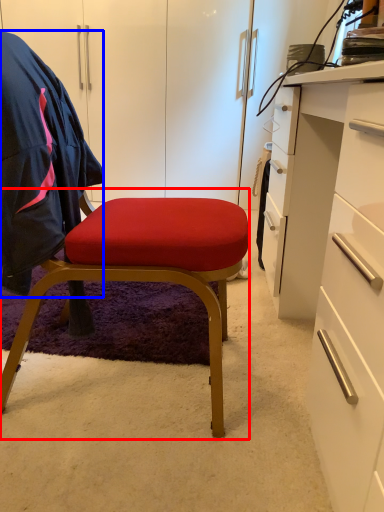
Question: Which object is further to the camera taking this photo, chair (highlighted by a red box) or clothing (highlighted by a blue box)?

Choices:
 (A) chair
 (B) clothing

Answer: (B)